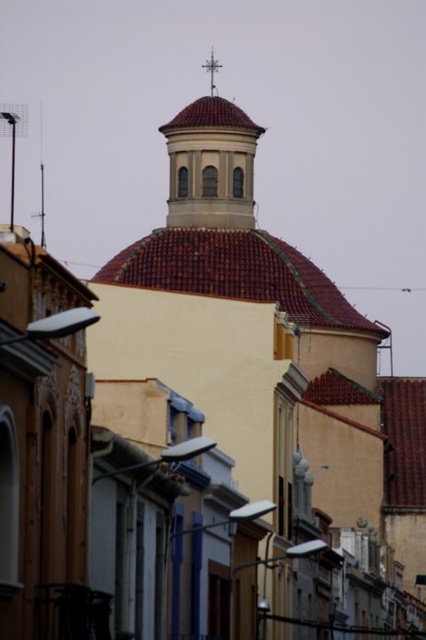
Question: Which of the following is the closest to the observer?

Choices:
 (A) metallic cross at upper center
 (B) matte red tile dome at center

Answer: (B)

Question: Among these points, which one is nearest to the camera?

Choices:
 (A) (218, 64)
 (B) (160, 129)

Answer: (B)

Question: Considering the relative positions of matte red tile dome at center and metallic cross at upper center in the image provided, where is matte red tile dome at center located with respect to metallic cross at upper center?

Choices:
 (A) left
 (B) right

Answer: (B)

Question: Is matte red tile dome at center positioned at the back of metallic cross at upper center?

Choices:
 (A) no
 (B) yes

Answer: (A)

Question: Which of the following is the closest to the observer?

Choices:
 (A) (210, 61)
 (B) (187, 152)

Answer: (B)

Question: Is matte red tile dome at center bigger than metallic cross at upper center?

Choices:
 (A) no
 (B) yes

Answer: (B)